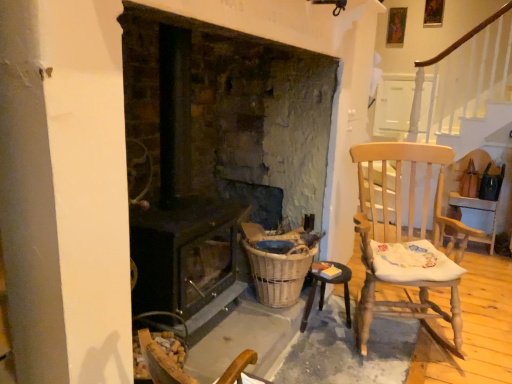
In order to click on free location to the right of wooden table at lower right in this screenshot , I will do `click(367, 331)`.